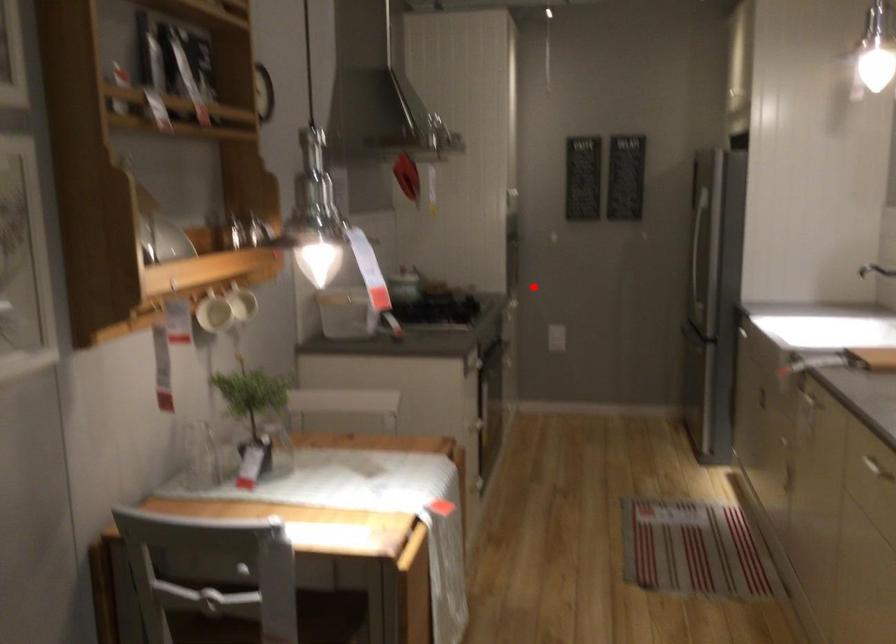
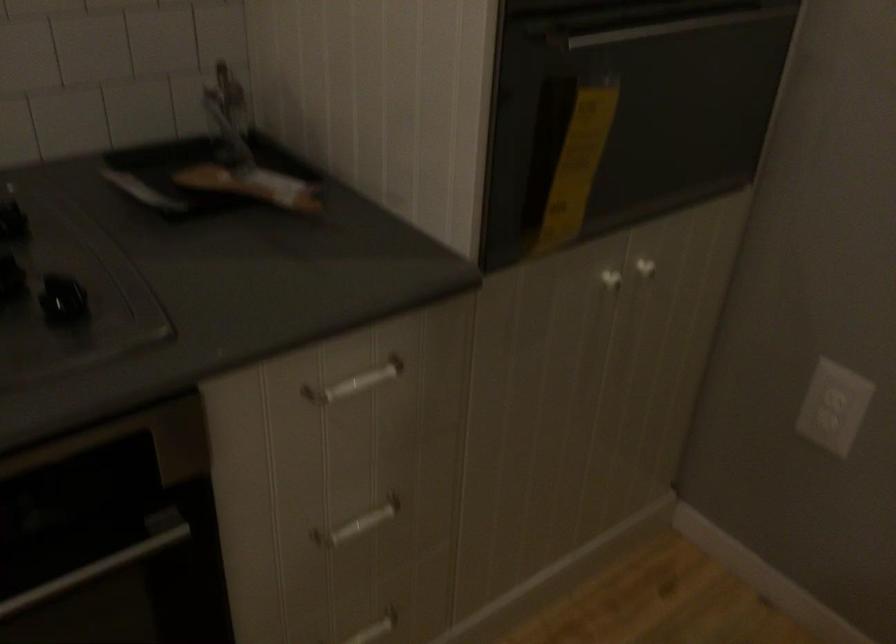
Question: I am providing you with two images of the same scene from different viewpoints. Given a red point in image1, look at the same physical point in image2. Is it:

Choices:
 (A) Closer to the viewpoint
 (B) Farther from the viewpoint

Answer: (A)